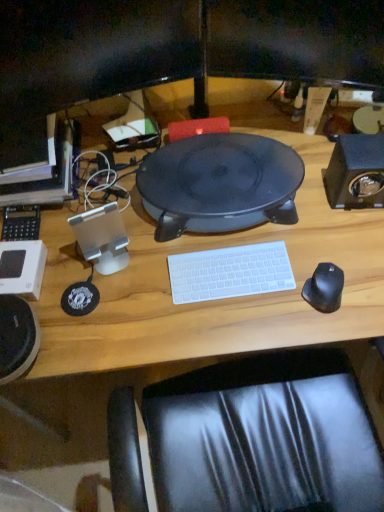
The height and width of the screenshot is (512, 384). In order to click on free space to the back side of black matte speaker at right in this screenshot , I will do `click(319, 143)`.